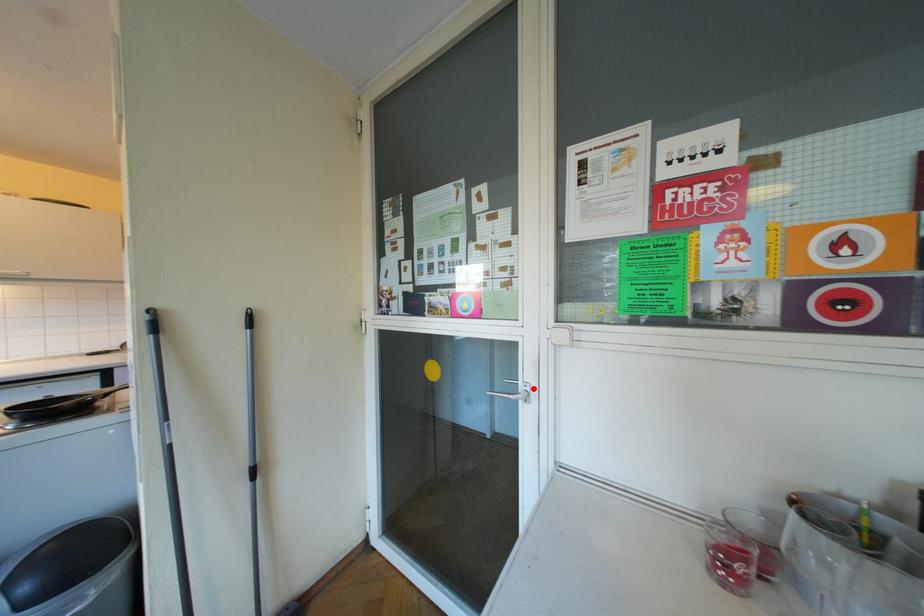
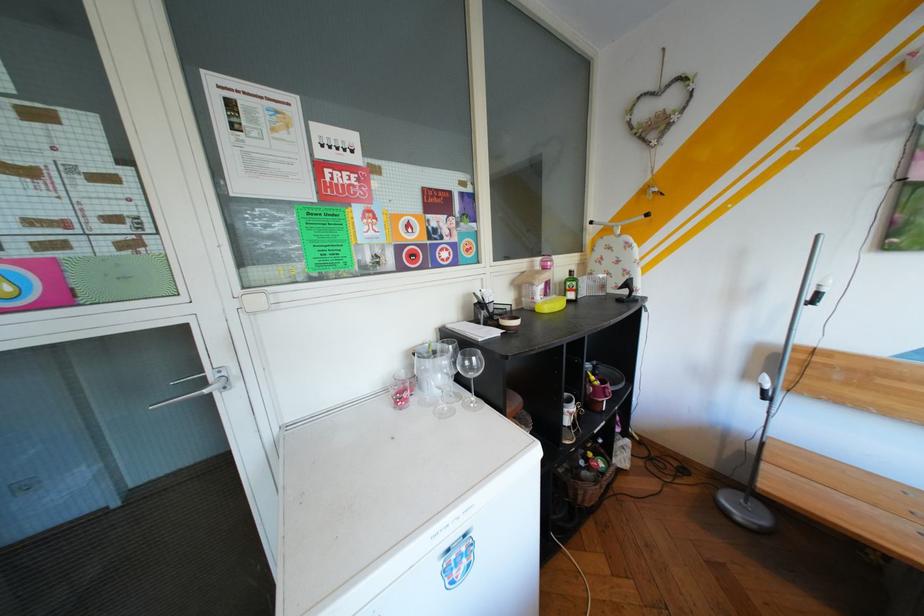
Locate, in the second image, the point that corresponds to the highlighted location in the first image.

(225, 379)